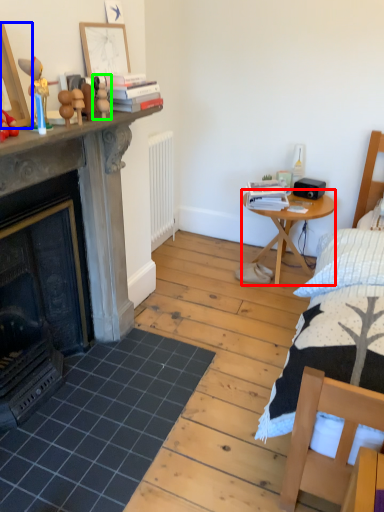
Question: Which is farther away from nightstand (highlighted by a red box)? picture frame (highlighted by a blue box) or toy (highlighted by a green box)?

Choices:
 (A) picture frame
 (B) toy

Answer: (A)